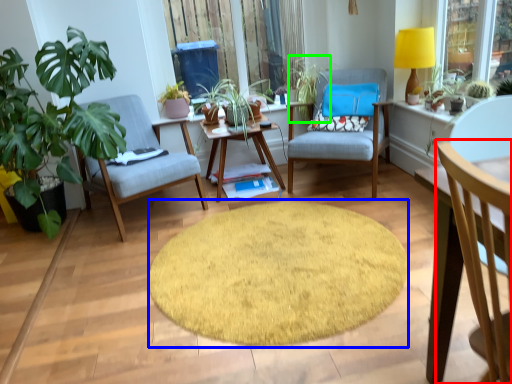
Question: Considering the real-world distances, which object is closest to chair (highlighted by a red box)? mat (highlighted by a blue box) or vegetation (highlighted by a green box).

Choices:
 (A) mat
 (B) vegetation

Answer: (A)